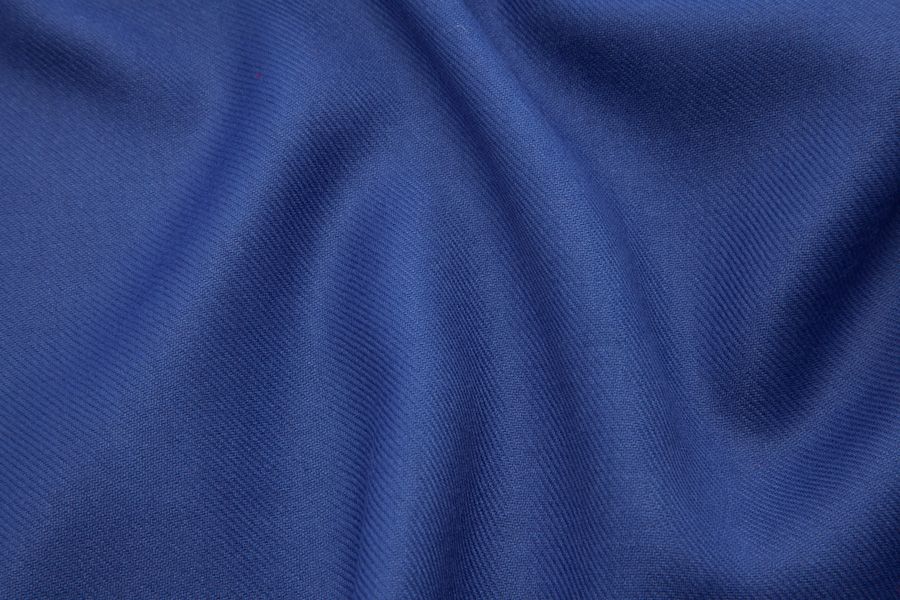
You are a GUI agent. You are given a task and a screenshot of the screen. Output one action in this format:
    pyautogui.click(x=<x>, y=<y>)
    Task: Click on the inside corner on the lower right hand side
    The image size is (900, 600).
    Given the screenshot: What is the action you would take?
    pyautogui.click(x=880, y=582)